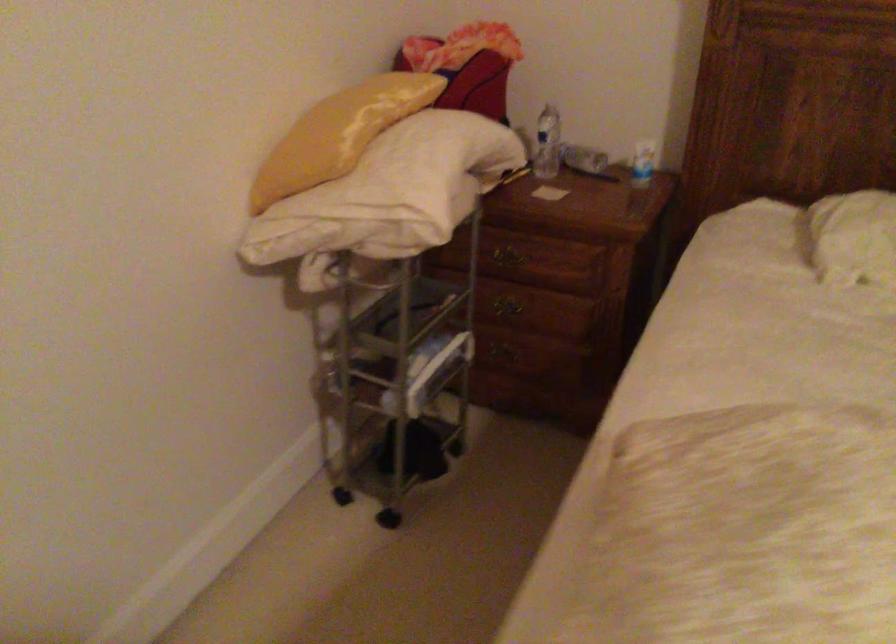
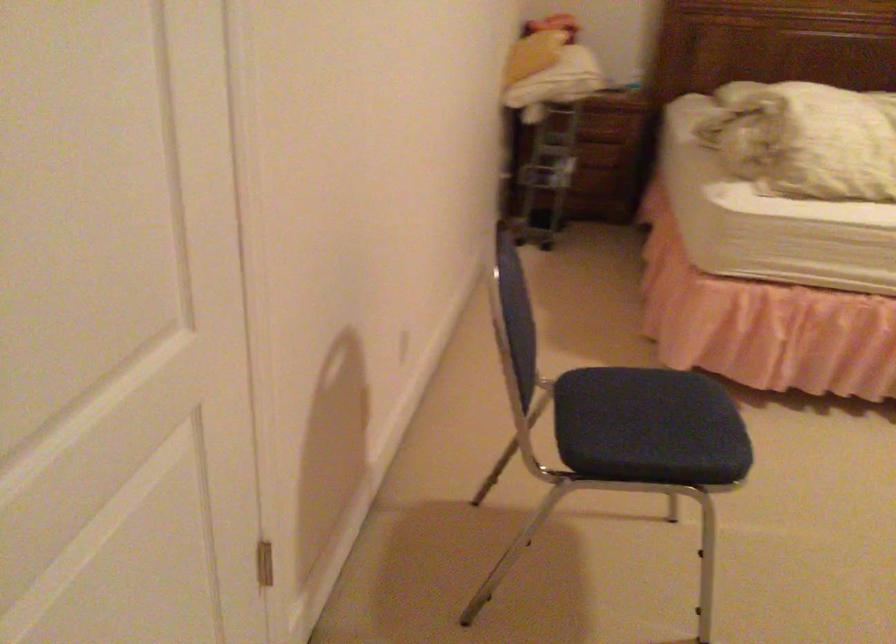
The images are taken continuously from a first-person perspective. In which direction are you moving?

The cameraman walked toward left, backward.